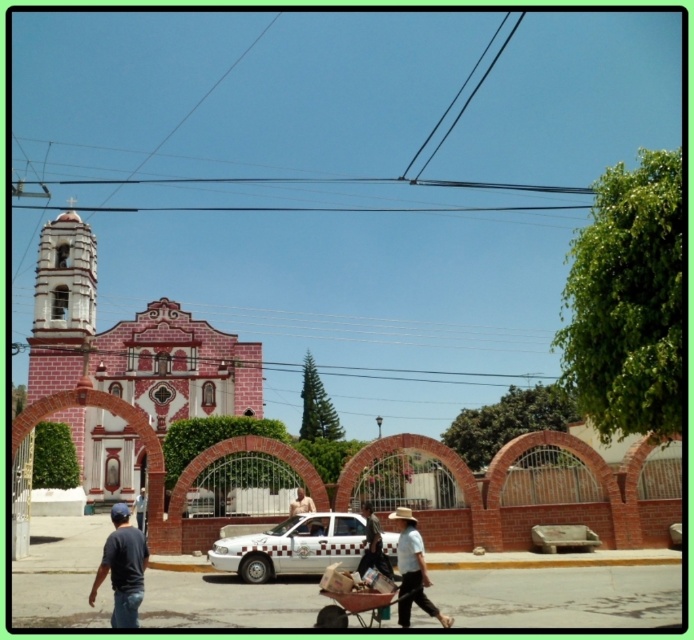
Question: Which of the following is the closest to the observer?

Choices:
 (A) light brown straw hat at center
 (B) red brick church at center

Answer: (A)

Question: Where is light brown straw hat at center located in relation to skinny man at center in the image?

Choices:
 (A) below
 (B) above

Answer: (A)

Question: Which point is closer to the camera taking this photo?

Choices:
 (A) (313, 509)
 (B) (335, 515)
 (C) (409, 582)

Answer: (C)

Question: Which of these objects is positioned farthest from the metallic silver cart at lower center?

Choices:
 (A) dark blue shirt at lower left
 (B) skinny man at center

Answer: (A)

Question: Can you confirm if dark blue shirt at lower left is positioned to the right of light brown straw hat at center?

Choices:
 (A) no
 (B) yes

Answer: (A)

Question: Is dark blue shirt at lower left thinner than metallic silver cart at lower center?

Choices:
 (A) yes
 (B) no

Answer: (B)